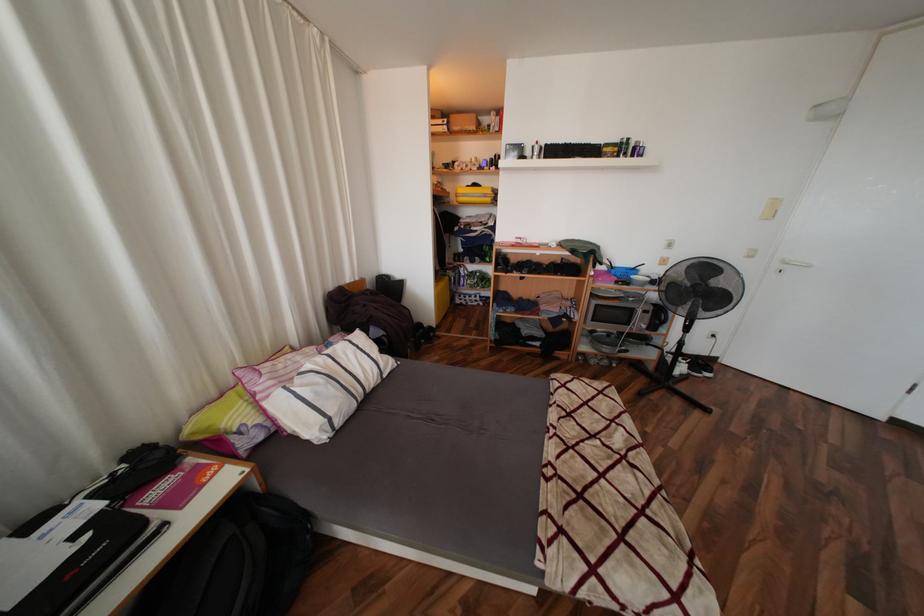
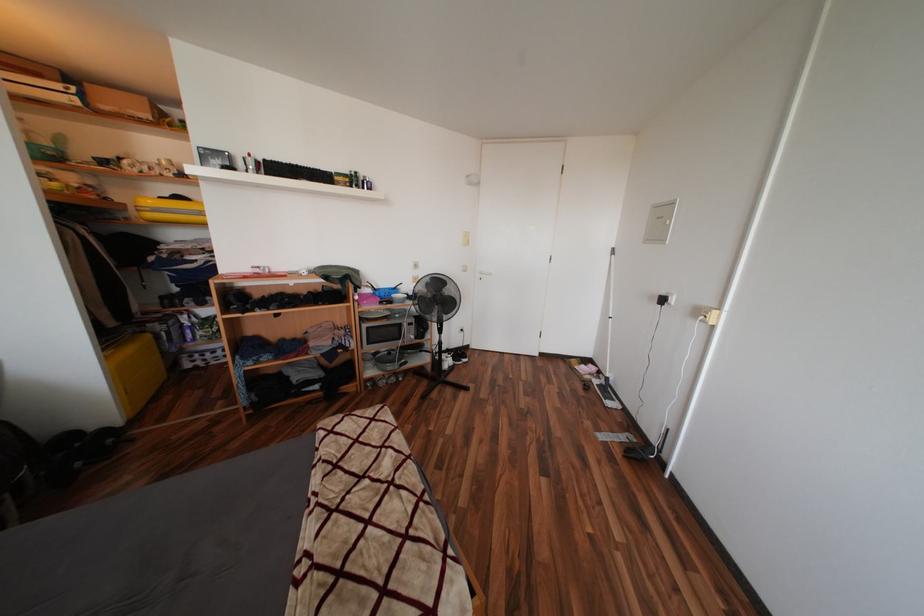
Question: How did the camera likely rotate?

Choices:
 (A) Left
 (B) Right
 (C) Up
 (D) Down

Answer: (B)